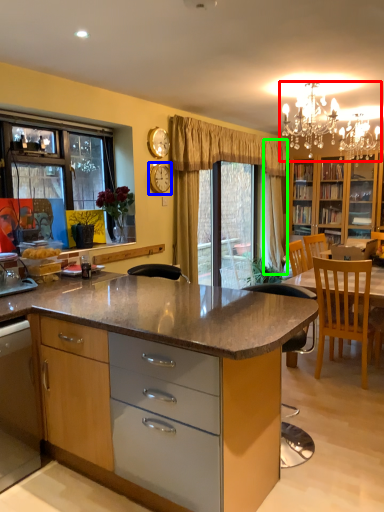
Question: Which is nearer to the light fixture (highlighted by a red box)? clock (highlighted by a blue box) or curtain (highlighted by a green box).

Choices:
 (A) clock
 (B) curtain

Answer: (B)